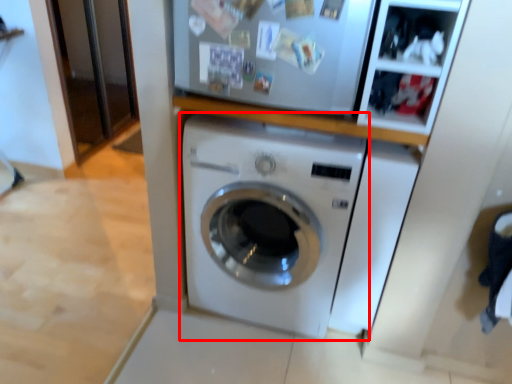
Question: In this image, where is washing machine (annotated by the red box) located relative to washing machine?

Choices:
 (A) left
 (B) right

Answer: (A)